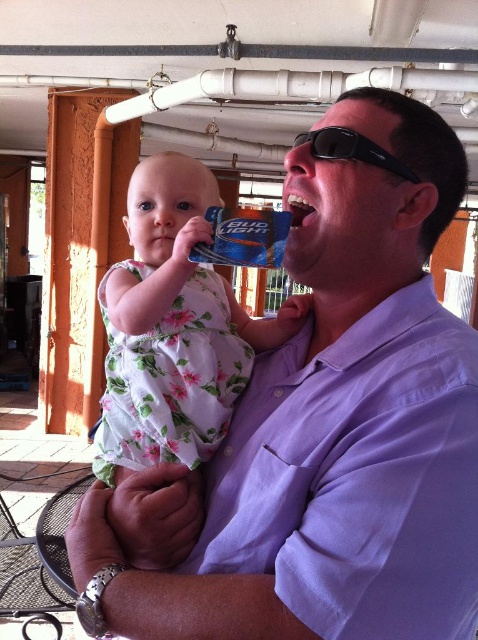
Between point (408, 172) and point (286, 195), which one is positioned in front?

Point (408, 172) is in front.

Can you confirm if black plastic sunglasses at upper center is wider than white glossy teeth at center?

Correct, the width of black plastic sunglasses at upper center exceeds that of white glossy teeth at center.

In the scene shown: Who is more forward, (372, 164) or (306, 216)?

Point (372, 164) is in front.

The width and height of the screenshot is (478, 640). Identify the location of black plastic sunglasses at upper center. (351, 148).

Is white floral dress at center to the left of white glossy teeth at center from the viewer's perspective?

Yes, white floral dress at center is to the left of white glossy teeth at center.

Is point (209, 285) less distant than point (297, 224)?

No.

Locate an element on the screen. Image resolution: width=478 pixels, height=640 pixels. white floral dress at center is located at coordinates (173, 328).

Between point (110, 346) and point (389, 161), which one is positioned behind?

The point (110, 346) is more distant.

Measure the distance between white floral dress at center and black plastic sunglasses at upper center.

13.25 inches

Who is more distant from viewer, [197,355] or [319,147]?

The point [197,355] is behind.

Identify the location of white floral dress at center. The height and width of the screenshot is (640, 478). (173, 328).